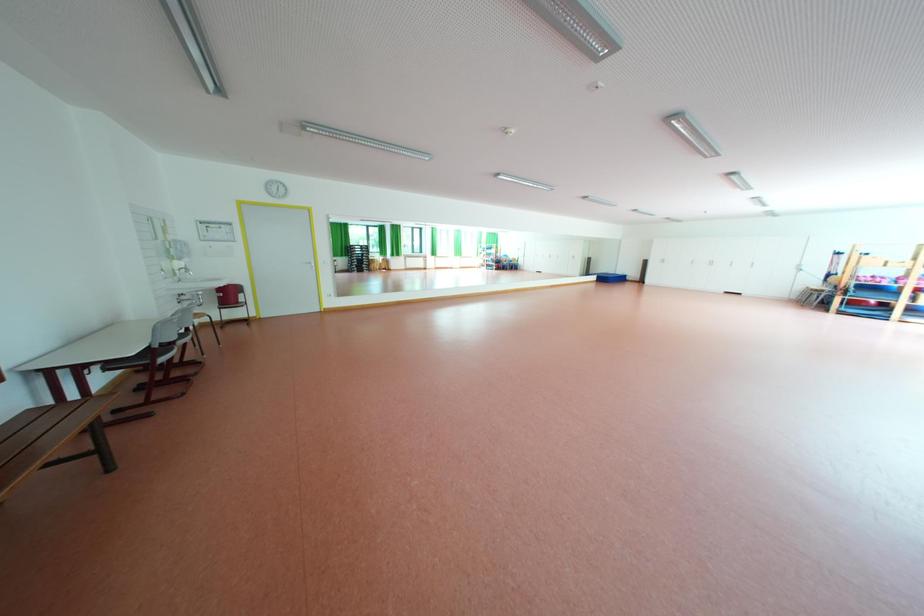
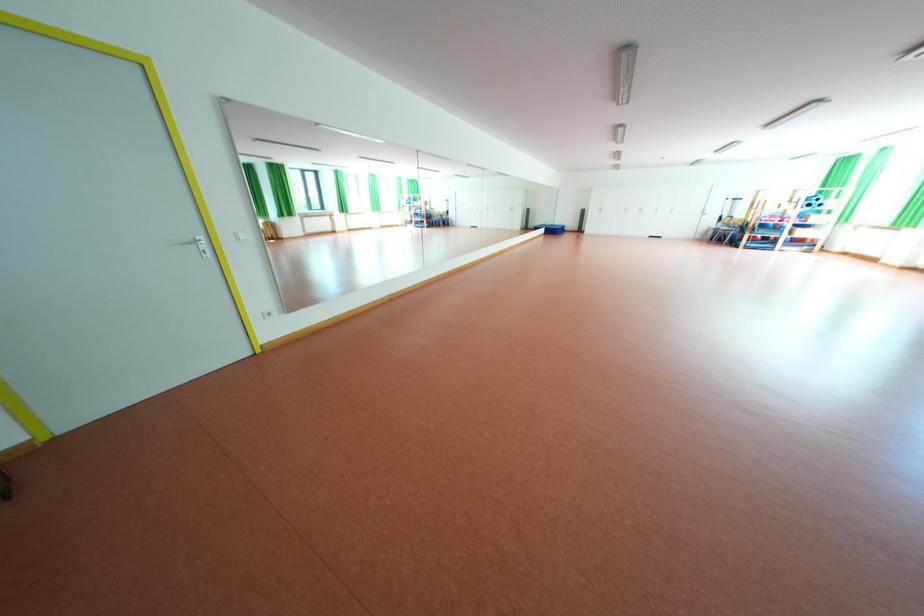
In a continuous first-person perspective shot, in which direction is the camera moving?

The movement direction of the cameraman is left, forward.